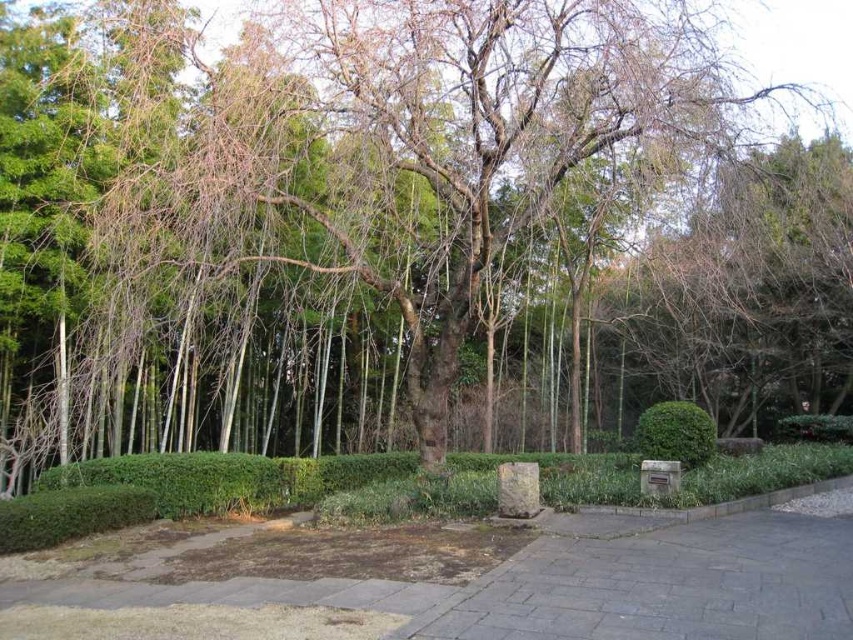
Consider the image. Between gray stone pavement at lower center and green matte bush at center, which one is positioned lower?

gray stone pavement at lower center

Who is taller, gray stone pavement at lower center or green matte bush at center?

Standing taller between the two is green matte bush at center.

Who is more forward, (x=786, y=627) or (x=675, y=442)?

Point (x=786, y=627) is in front.

The width and height of the screenshot is (853, 640). What are the coordinates of `gray stone pavement at lower center` in the screenshot? It's located at (662, 584).